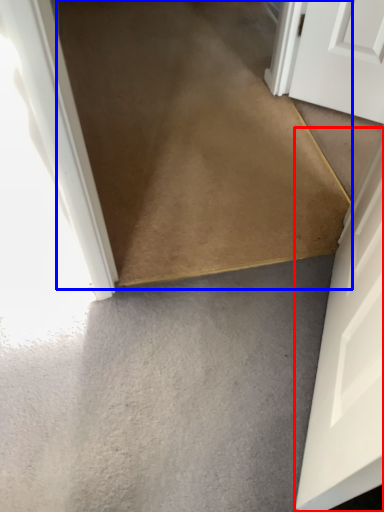
Question: Which point is further to the camera, door (highlighted by a red box) or path (highlighted by a blue box)?

Choices:
 (A) door
 (B) path

Answer: (B)